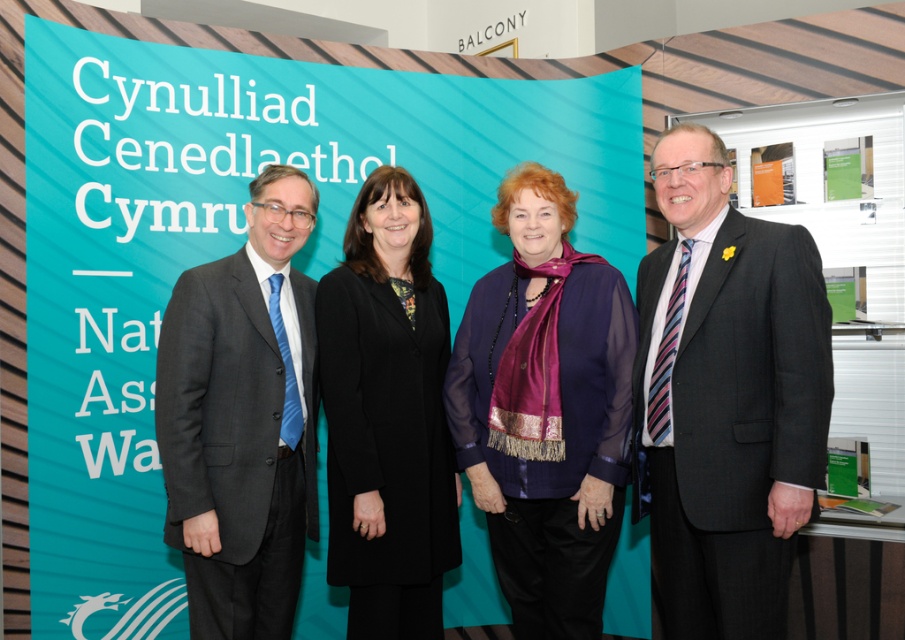
Question: Which object is the farthest from the dark gray suit at right?

Choices:
 (A) purple silk scarf at center
 (B) teal fabric banner at upper center

Answer: (B)

Question: Does dark gray suit at right have a smaller size compared to dark gray suit at left?

Choices:
 (A) no
 (B) yes

Answer: (A)

Question: Where is dark gray suit at left located in relation to black wool coat at center in the image?

Choices:
 (A) right
 (B) left

Answer: (B)

Question: Does teal fabric banner at upper center have a smaller size compared to dark gray suit at right?

Choices:
 (A) yes
 (B) no

Answer: (B)

Question: Which of the following is the farthest from the observer?

Choices:
 (A) [501, 428]
 (B) [416, 193]
 (C) [192, 545]
 (D) [684, 193]

Answer: (B)

Question: Estimate the real-world distances between objects in this image. Which object is closer to the purple silk scarf at center?

Choices:
 (A) teal fabric banner at upper center
 (B) dark gray suit at left

Answer: (B)